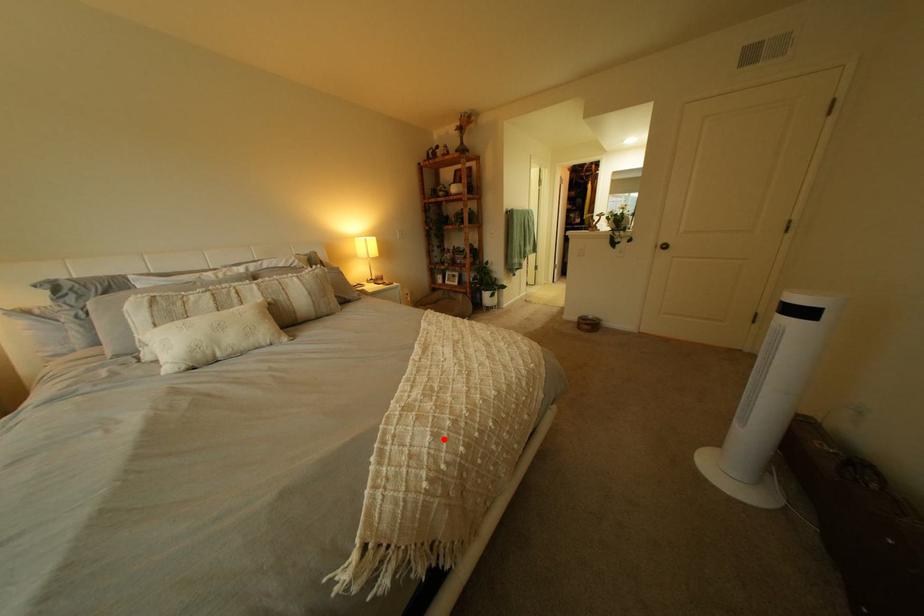
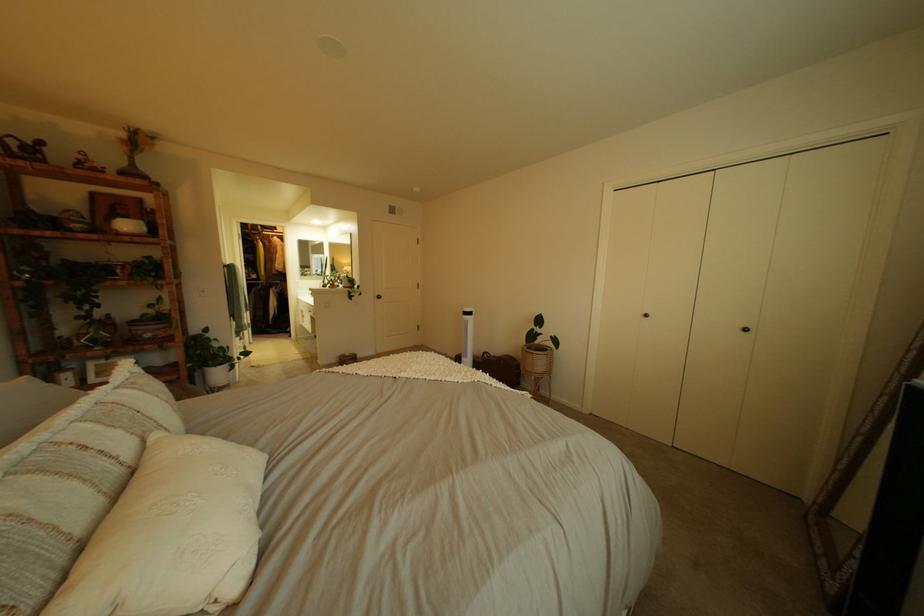
In the second image, find the point that corresponds to the highlighted location in the first image.

(504, 376)